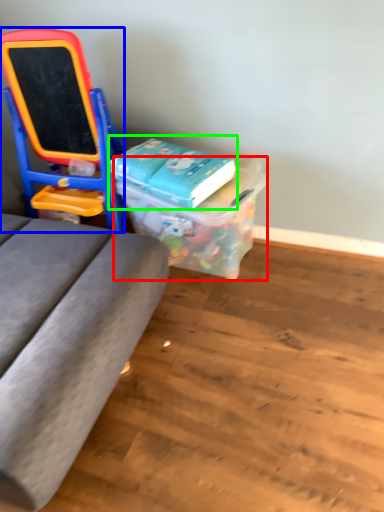
Question: Considering the real-world distances, which object is closest to box (highlighted by a red box)? furniture (highlighted by a blue box) or book (highlighted by a green box).

Choices:
 (A) furniture
 (B) book

Answer: (B)